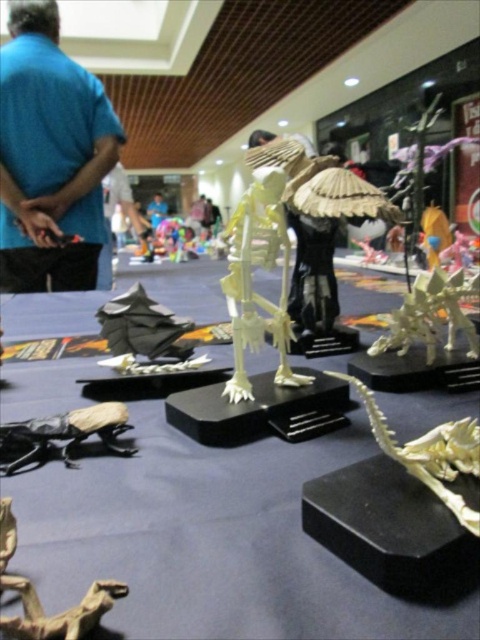
What do you see at coordinates (251, 280) in the screenshot? I see `translucent white skeleton at center` at bounding box center [251, 280].

Consider the image. Between translucent white skeleton at center and brown paper-like dinosaur at lower left, which one is positioned lower?

brown paper-like dinosaur at lower left is lower down.

Is point (241, 378) farther from viewer compared to point (3, 532)?

Yes.

I want to click on translucent white skeleton at center, so click(251, 280).

Is the position of translucent white skeleton at center more distant than that of matte black beetle at lower left?

Yes, it is.

Is point (264, 212) positioned after point (73, 442)?

Yes, it is behind point (73, 442).

Between point (230, 256) and point (3, 442), which one is positioned in front?

Point (3, 442) is in front.

The width and height of the screenshot is (480, 640). What are the coordinates of `translucent white skeleton at center` in the screenshot? It's located at (251, 280).

Does blue fabric shirt at upper left come behind matte black beetle at lower left?

Yes.

Is point (55, 170) farther from camera compared to point (23, 424)?

Yes, it is.

Which is behind, point (44, 237) or point (72, 436)?

The point (44, 237) is behind.

Locate an element on the screen. The image size is (480, 640). blue fabric shirt at upper left is located at coordinates (49, 156).